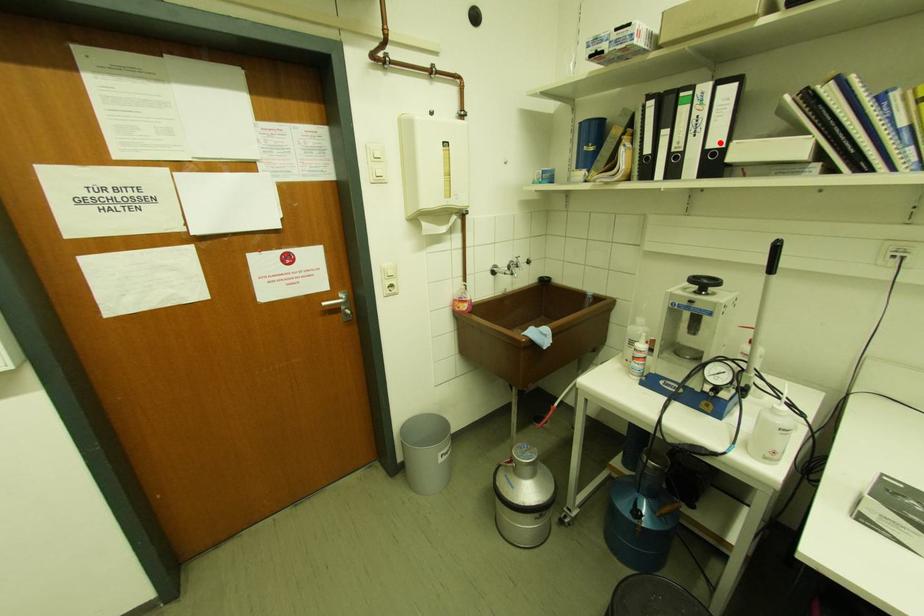
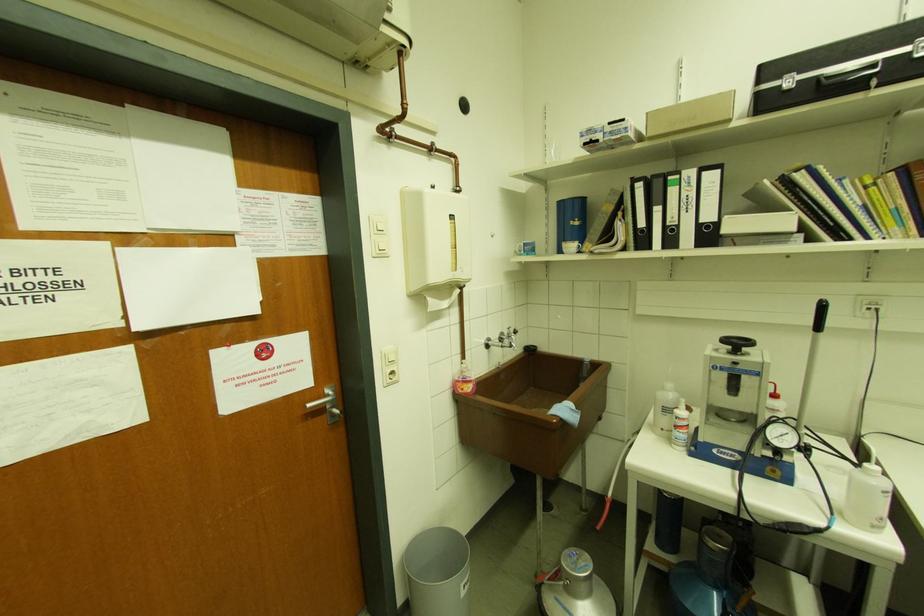
Find the pixel in the second image that matches the highlighted location in the first image.

(712, 217)